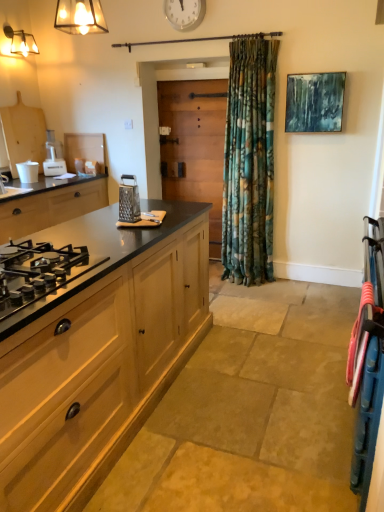
Question: Is wooden at center bigger than wooden cabinet at left, placed as the 2th cabinetry when sorted from left to right?

Choices:
 (A) no
 (B) yes

Answer: (A)

Question: From the image's perspective, is wooden at center on wooden cabinet at left, placed as the 2th cabinetry when sorted from left to right?

Choices:
 (A) no
 (B) yes

Answer: (B)

Question: Is wooden at center to the right of wooden cabinet at left, the first cabinetry positioned from the bottom, from the viewer's perspective?

Choices:
 (A) yes
 (B) no

Answer: (B)

Question: Is wooden at center facing towards wooden cabinet at left, the second cabinetry positioned from the top?

Choices:
 (A) yes
 (B) no

Answer: (B)

Question: Does wooden at center have a smaller size compared to wooden cabinet at left, the second cabinetry positioned from the top?

Choices:
 (A) yes
 (B) no

Answer: (A)

Question: Is wooden at center not close to wooden cabinet at left, the second cabinetry positioned from the top?

Choices:
 (A) no
 (B) yes

Answer: (B)

Question: Is black matte gas stove at left, the 1th cabinetry in the top-to-bottom sequence, not close to wooden at center?

Choices:
 (A) yes
 (B) no

Answer: (A)

Question: Is black matte gas stove at left, the first cabinetry viewed from the left, looking in the opposite direction of wooden at center?

Choices:
 (A) yes
 (B) no

Answer: (B)

Question: Is the surface of black matte gas stove at left, the 1th cabinetry in the top-to-bottom sequence, in direct contact with wooden at center?

Choices:
 (A) no
 (B) yes

Answer: (A)

Question: Can you confirm if black matte gas stove at left, the first cabinetry viewed from the left, is taller than wooden at center?

Choices:
 (A) yes
 (B) no

Answer: (B)

Question: Does black matte gas stove at left, the 1th cabinetry in the top-to-bottom sequence, have a larger size compared to wooden at center?

Choices:
 (A) no
 (B) yes

Answer: (B)

Question: Is black matte gas stove at left, the first cabinetry viewed from the left, shorter than wooden at center?

Choices:
 (A) yes
 (B) no

Answer: (A)

Question: Is metallic glass light fixture at upper left facing away from wooden at center?

Choices:
 (A) no
 (B) yes

Answer: (A)